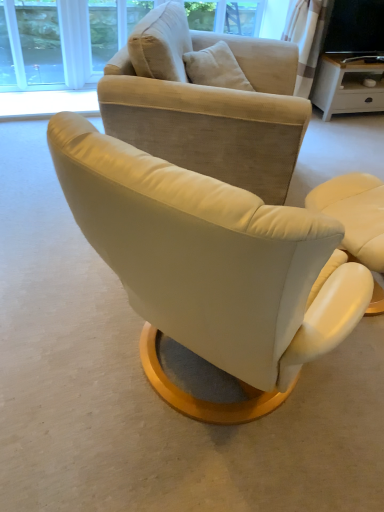
Question: Considering the relative sizes of matte white desk at upper right and suede beige armchair at center, arranged as the first chair when viewed from the left, in the image provided, is matte white desk at upper right bigger than suede beige armchair at center, arranged as the first chair when viewed from the left,?

Choices:
 (A) yes
 (B) no

Answer: (B)

Question: Can we say matte white desk at upper right lies outside suede beige armchair at center, which ranks as the 3th chair in right-to-left order?

Choices:
 (A) yes
 (B) no

Answer: (A)

Question: From the image's perspective, is matte white desk at upper right located above suede beige armchair at center, arranged as the first chair when viewed from the left?

Choices:
 (A) yes
 (B) no

Answer: (A)

Question: Does matte white desk at upper right have a lesser width compared to suede beige armchair at center, which ranks as the 3th chair in right-to-left order?

Choices:
 (A) yes
 (B) no

Answer: (A)

Question: Are matte white desk at upper right and suede beige armchair at center, arranged as the first chair when viewed from the left, far apart?

Choices:
 (A) no
 (B) yes

Answer: (B)

Question: Would you say suede beige armchair at center, which ranks as the 3th chair in right-to-left order, is inside or outside matte white desk at upper right?

Choices:
 (A) inside
 (B) outside

Answer: (B)

Question: Is point (281, 93) closer or farther from the camera than point (377, 79)?

Choices:
 (A) closer
 (B) farther

Answer: (A)

Question: Considering their positions, is suede beige armchair at center, arranged as the first chair when viewed from the left, located in front of or behind matte white desk at upper right?

Choices:
 (A) behind
 (B) front

Answer: (B)

Question: Considering the positions of suede beige armchair at center, arranged as the first chair when viewed from the left, and matte white desk at upper right in the image, is suede beige armchair at center, arranged as the first chair when viewed from the left, wider or thinner than matte white desk at upper right?

Choices:
 (A) thin
 (B) wide

Answer: (B)

Question: In terms of height, does matte white desk at upper right look taller or shorter compared to leather armchair at center, positioned as the second chair in right-to-left order?

Choices:
 (A) tall
 (B) short

Answer: (A)

Question: From the image's perspective, is matte white desk at upper right located above or below leather armchair at center, positioned as the second chair in right-to-left order?

Choices:
 (A) below
 (B) above

Answer: (B)

Question: Which is correct: matte white desk at upper right is inside leather armchair at center, positioned as the second chair in right-to-left order, or outside of it?

Choices:
 (A) outside
 (B) inside

Answer: (A)

Question: Looking at their shapes, would you say matte white desk at upper right is wider or thinner than leather armchair at center, positioned as the second chair in right-to-left order?

Choices:
 (A) thin
 (B) wide

Answer: (A)

Question: In the image, is leather armchair at center, the second chair when ordered from left to right, positioned in front of or behind matte white desk at upper right?

Choices:
 (A) behind
 (B) front

Answer: (B)

Question: Looking at their shapes, would you say leather armchair at center, the second chair when ordered from left to right, is wider or thinner than matte white desk at upper right?

Choices:
 (A) thin
 (B) wide

Answer: (B)